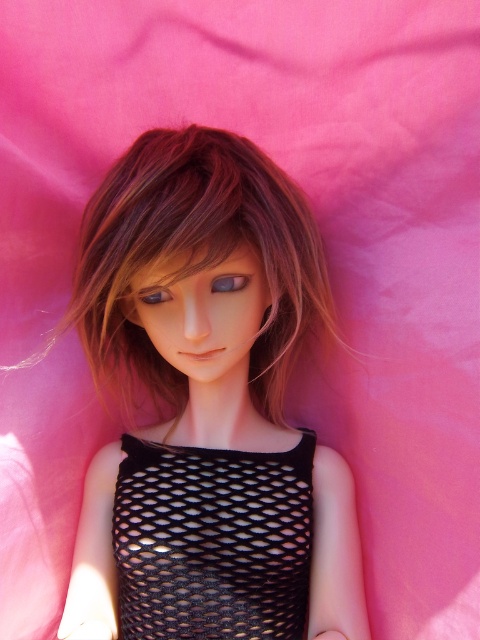
You are a fashion designer examining a doll dressed in a black mesh dress at center and a doll with a satin blue eye at center. Which of these two items is taller?

The black mesh dress at center is taller than the satin blue eye at center.

You are a fashion designer who wants to place a purple glossy eye at center onto the black mesh dress at center. Considering their sizes, will the dress be able to accommodate the eye without overlapping?

The black mesh dress at center is wider than the purple glossy eye at center, so the dress can accommodate the eye without overlapping.

You are a fashion designer preparing to place a purple glossy eye at center on a mannequin wearing a satin black dress at center. Considering their sizes, will the eye fit comfortably on the dress without overlapping?

The satin black dress at center is much taller than the purple glossy eye at center, so the eye should fit comfortably on the dress without overlapping.